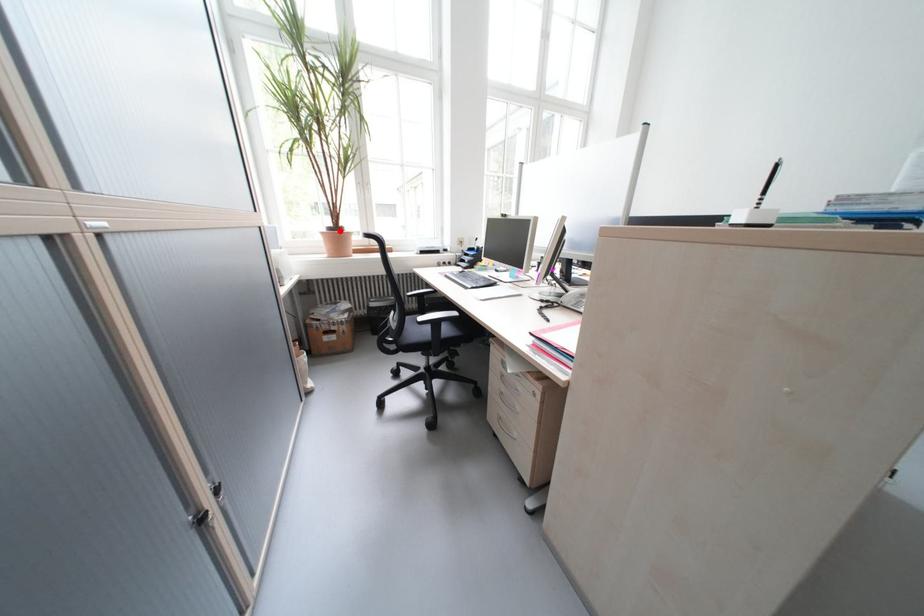
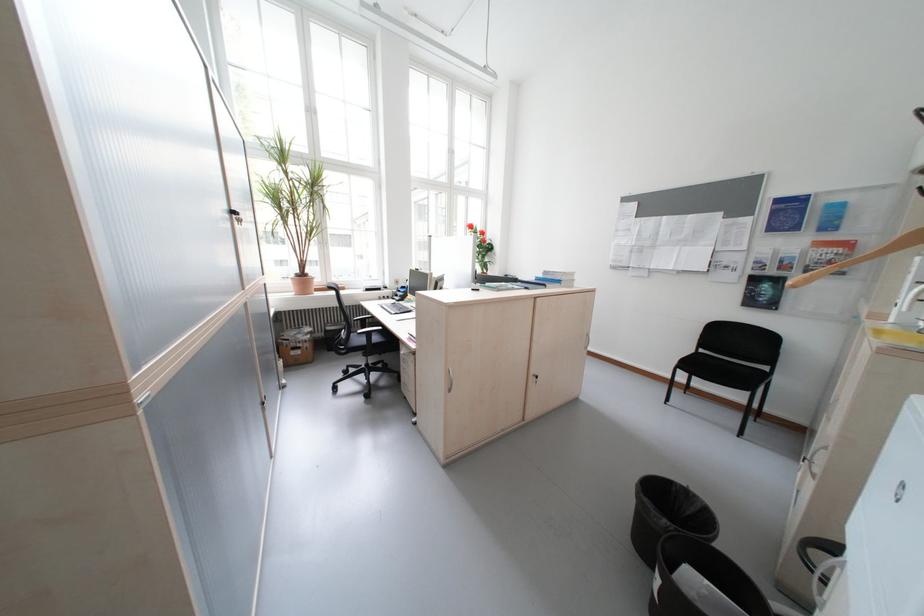
In the second image, find the point that corresponds to the highlighted location in the first image.

(308, 277)